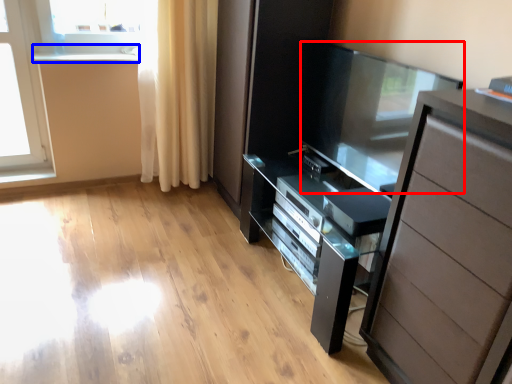
Question: Which of the following is the farthest to the observer, screen door (highlighted by a red box) or window sill (highlighted by a blue box)?

Choices:
 (A) screen door
 (B) window sill

Answer: (B)